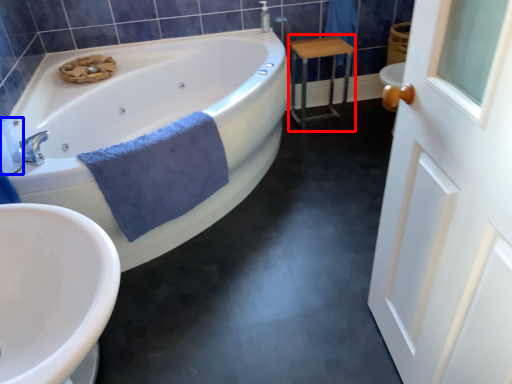
Question: Which of the following is the closest to the observer, table (highlighted by a red box) or toiletry (highlighted by a blue box)?

Choices:
 (A) table
 (B) toiletry

Answer: (B)